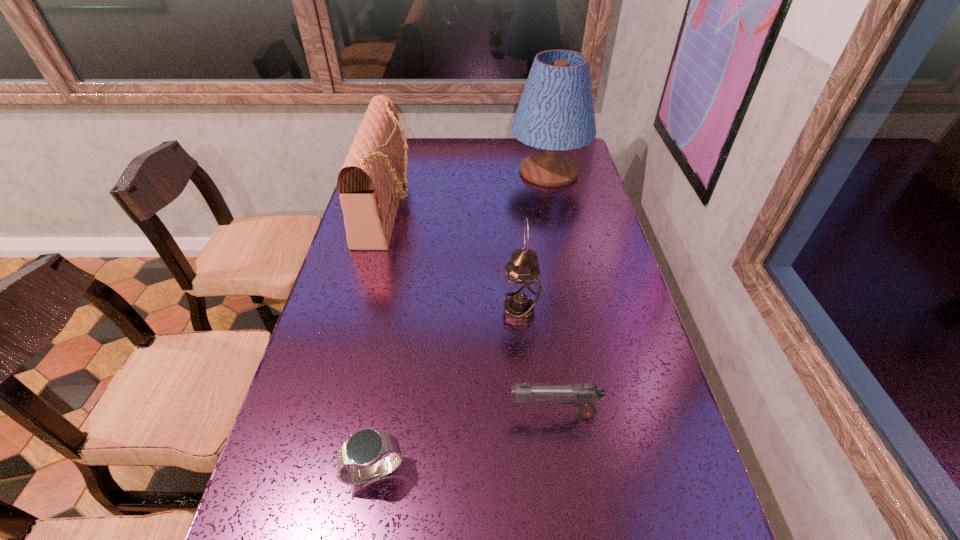
The image size is (960, 540). In the image, there is a desktop. Find the location of `free space at the far left corner`. free space at the far left corner is located at coordinates (410, 165).

Locate an element on the screen. The width and height of the screenshot is (960, 540). free space at the far right corner of the desktop is located at coordinates (571, 152).

You are a GUI agent. You are given a task and a screenshot of the screen. Output one action in this format:
    pyautogui.click(x=<x>, y=<y>)
    Task: Click on the free space between the oil lamp and the second nearest object
    Image resolution: width=960 pixels, height=540 pixels.
    Given the screenshot: What is the action you would take?
    pyautogui.click(x=537, y=363)

Locate an element on the screen. Image resolution: width=960 pixels, height=540 pixels. free space between the handbag and the watch is located at coordinates (381, 339).

At what (x,y) coordinates should I click in order to perform the action: click on free space between the fourth farthest object and the nearest object. Please return your answer as a coordinate pair (x, y). The image size is (960, 540). Looking at the image, I should click on (464, 443).

This screenshot has height=540, width=960. Identify the location of free spot between the second nearest object and the watch. (464, 443).

The width and height of the screenshot is (960, 540). In order to click on empty space that is in between the handbag and the nearest object in this screenshot , I will do `click(381, 339)`.

The height and width of the screenshot is (540, 960). In order to click on free space between the handbag and the tallest object in this screenshot , I will do `click(468, 189)`.

Locate an element on the screen. The height and width of the screenshot is (540, 960). free spot between the lampshade and the second nearest object is located at coordinates (551, 293).

Find the location of a particular element. The image size is (960, 540). empty space between the third nearest object and the handbag is located at coordinates (454, 259).